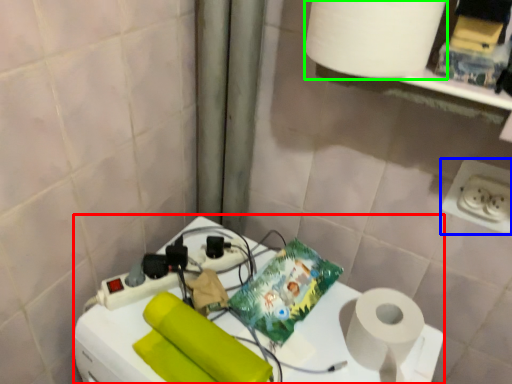
Question: Which is nearer to the appliance (highlighted by a red box)? power plugs and sockets (highlighted by a blue box) or paper towel (highlighted by a green box).

Choices:
 (A) power plugs and sockets
 (B) paper towel

Answer: (A)